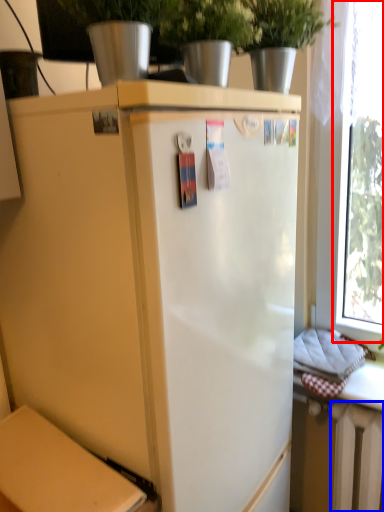
Question: Which point is closer to the camera, window (highlighted by a red box) or radiator (highlighted by a blue box)?

Choices:
 (A) window
 (B) radiator

Answer: (A)